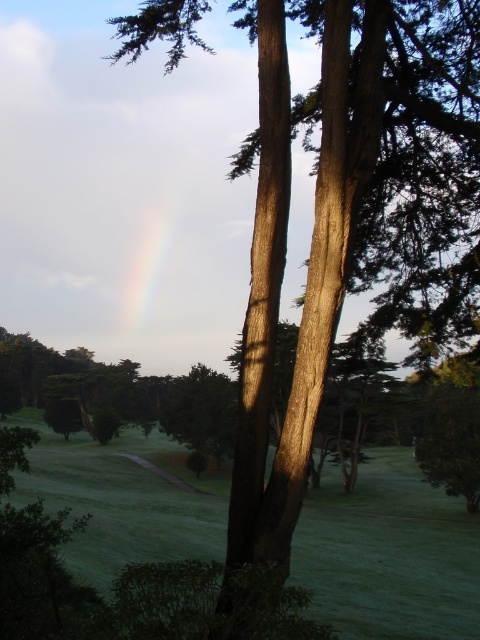
Question: Does green matte tree at center have a smaller size compared to rainbow translucent at center?

Choices:
 (A) no
 (B) yes

Answer: (B)

Question: Among these objects, which one is farthest from the camera?

Choices:
 (A) rainbow translucent at center
 (B) green matte tree at center
 (C) green grass at center

Answer: (A)

Question: Which point appears closest to the camera in this image?

Choices:
 (A) (97, 572)
 (B) (170, 410)

Answer: (A)

Question: Is green matte tree at center further to camera compared to rainbow translucent at center?

Choices:
 (A) yes
 (B) no

Answer: (B)

Question: Does green grass at center have a larger size compared to green matte tree at center?

Choices:
 (A) no
 (B) yes

Answer: (B)

Question: Which of the following is the farthest from the observer?

Choices:
 (A) (471, 611)
 (B) (153, 237)
 (C) (170, 435)

Answer: (B)